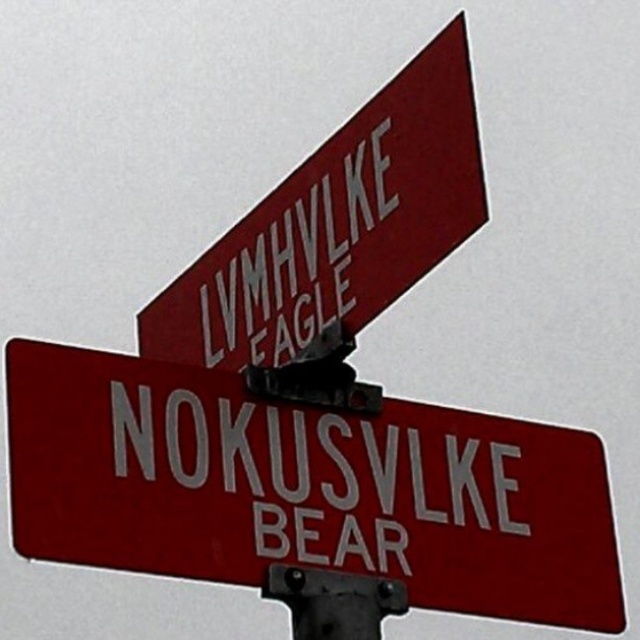
Question: Which point appears farthest from the camera in this image?

Choices:
 (A) (300, 513)
 (B) (374, 589)
 (C) (464, 76)
 (D) (609, 536)

Answer: (D)

Question: Which point is farther from the camera taking this photo?

Choices:
 (A) (396, 582)
 (B) (273, 260)

Answer: (B)

Question: Is smooth red sign at center thinner than white glossy street sign at center?

Choices:
 (A) yes
 (B) no

Answer: (B)

Question: Which point is farther from the camera taking this photo?

Choices:
 (A) (209, 392)
 (B) (344, 285)

Answer: (B)

Question: From the image, what is the correct spatial relationship of smooth red sign at upper center in relation to white glossy street sign at center?

Choices:
 (A) left
 (B) right

Answer: (A)

Question: Can you confirm if smooth red sign at center is positioned above white glossy street sign at center?

Choices:
 (A) no
 (B) yes

Answer: (A)